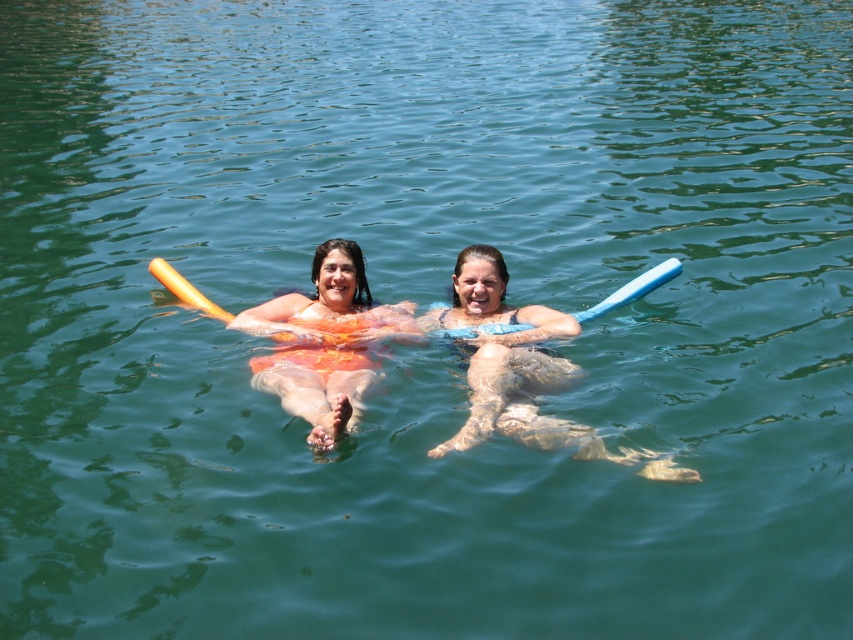
You are a swimmer who wants to use the items in the water to help you float. Which item should you choose between the blue rubber float at center and the blue foam paddle at center?

The blue rubber float at center is bigger than the blue foam paddle at center, so it would provide better buoyancy and stability for floating.